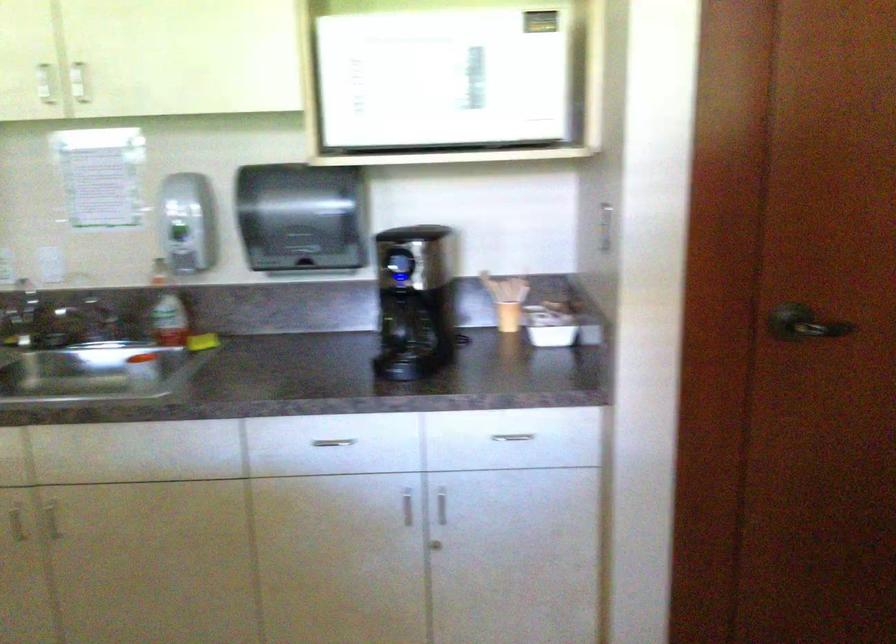
Where would you push the coffee maker button? Please return your answer as a coordinate pair (x, y).

(399, 263)